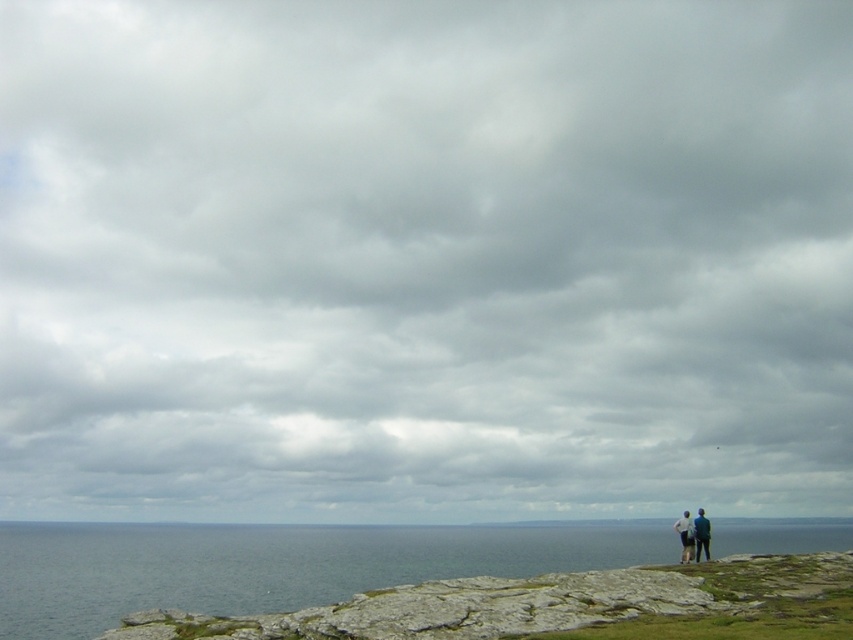
Question: Among these points, which one is farthest from the camera?

Choices:
 (A) (73, 592)
 (B) (674, 525)
 (C) (680, 524)

Answer: (A)

Question: Can you confirm if blue denim jacket at lower right is positioned above white cotton shirt at right?

Choices:
 (A) yes
 (B) no

Answer: (A)

Question: Among these points, which one is nearest to the camera?

Choices:
 (A) (683, 540)
 (B) (706, 561)
 (C) (76, 593)

Answer: (B)

Question: Which point appears closest to the camera in this image?

Choices:
 (A) click(700, 508)
 (B) click(560, 548)
 (C) click(686, 561)

Answer: (C)

Question: Does blue water at lower left appear on the left side of blue denim jacket at lower right?

Choices:
 (A) yes
 (B) no

Answer: (B)

Question: Is blue denim jacket at lower right wider than white cotton shirt at right?

Choices:
 (A) yes
 (B) no

Answer: (B)